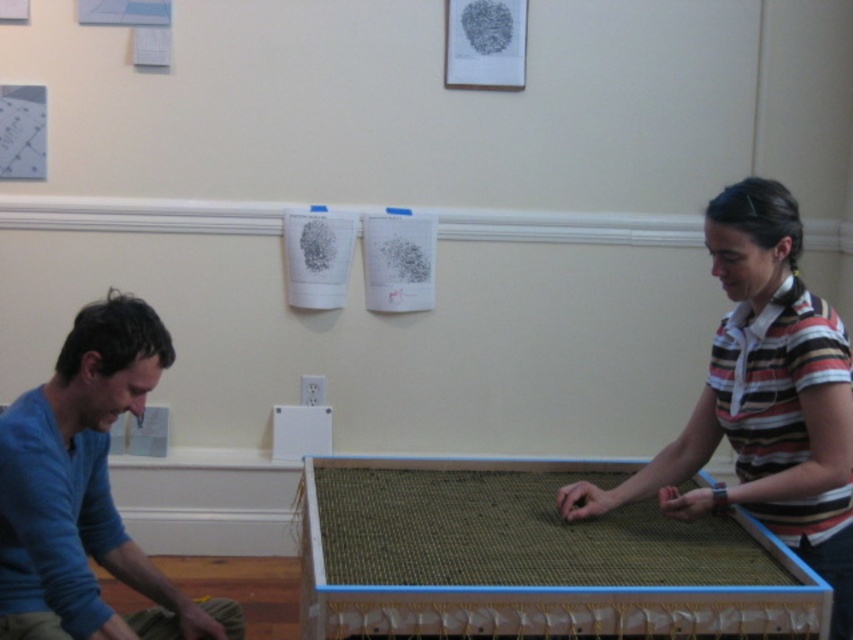
Is striped cotton shirt at center shorter than blue cotton shirt at left?

No.

Does striped cotton shirt at center appear under blue cotton shirt at left?

No.

Find the location of `striped cotton shirt at center`. striped cotton shirt at center is located at coordinates (763, 400).